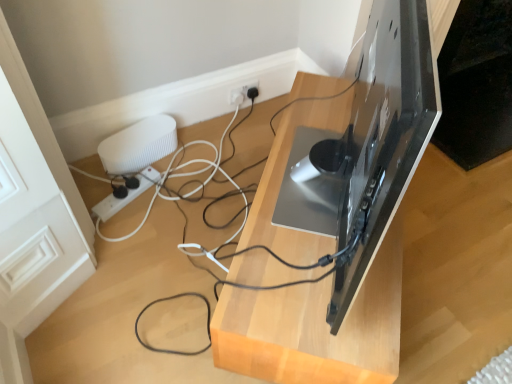
At what (x,y) coordinates should I click in order to perform the action: click on vacant area to the right of white ribbed speaker at left. Please return your answer as a coordinate pair (x, y). This screenshot has width=512, height=384. Looking at the image, I should click on (198, 160).